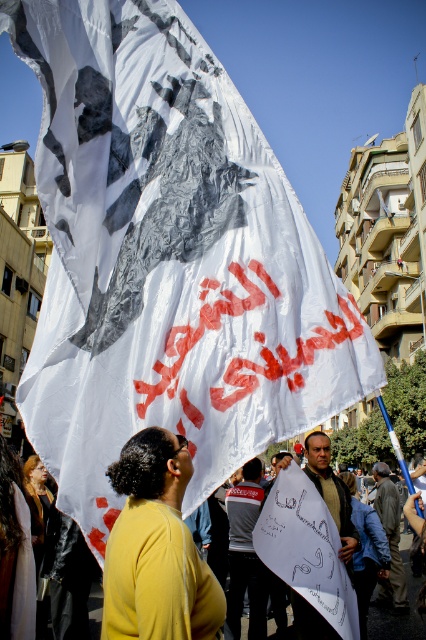
Locate an element on the screen. yellow matte shirt at center is located at coordinates (155, 548).

Is yellow matte shirt at center in front of dark gray fabric at center?

Yes, yellow matte shirt at center is closer to the viewer.

Is point (163, 564) farther from viewer compared to point (396, 556)?

No, it is not.

Image resolution: width=426 pixels, height=640 pixels. I want to click on yellow matte shirt at center, so click(155, 548).

Describe the element at coordinates (155, 548) in the screenshot. I see `yellow matte shirt at center` at that location.

Does yellow matte shirt at center appear on the right side of dark gray sweater at center?

No, yellow matte shirt at center is not to the right of dark gray sweater at center.

Locate an element on the screen. yellow matte shirt at center is located at coordinates (155, 548).

This screenshot has width=426, height=640. What are the coordinates of `yellow matte shirt at center` in the screenshot? It's located at (155, 548).

Locate an element on the screen. The image size is (426, 640). dark gray sweater at center is located at coordinates (245, 556).

In the scene shown: Can you confirm if dark gray sweater at center is taller than dark brown leather jacket at center?

Yes, dark gray sweater at center is taller than dark brown leather jacket at center.

Does point (230, 554) lie behind point (327, 493)?

Yes, it is behind point (327, 493).

Image resolution: width=426 pixels, height=640 pixels. I want to click on dark gray sweater at center, so click(245, 556).